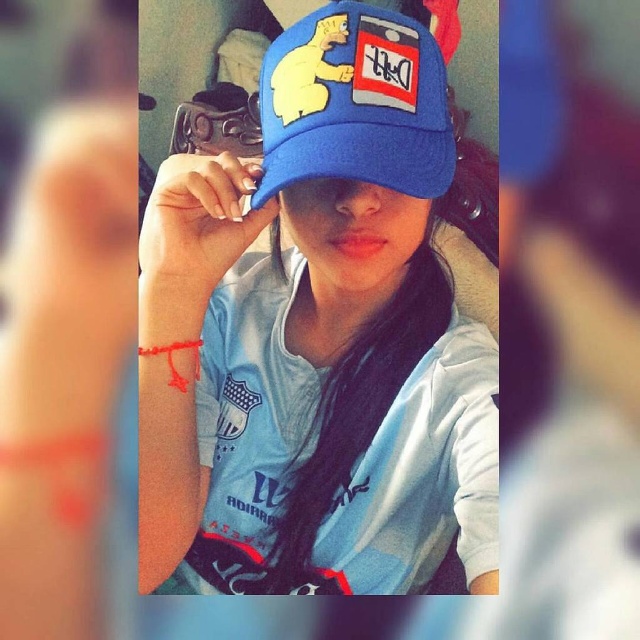
You are trying to describe the position of the blue fabric cap at center and the blue fabric baseball cap at center in the image. Which one is located to the left?

The blue fabric cap at center is located to the left of the blue fabric baseball cap at center.

You are trying to decide which blue cap to wear for a team event. Both the blue fabric cap at center and the blue fabric baseball cap at center are options. Which one has a wider width?

The blue fabric cap at center has a larger width than the blue fabric baseball cap at center according to the description.

Where is the blue fabric cap at center located in the image?

The blue fabric cap at center is located at point 0.528 in the x coordinate and 0.497 in the y coordinate.